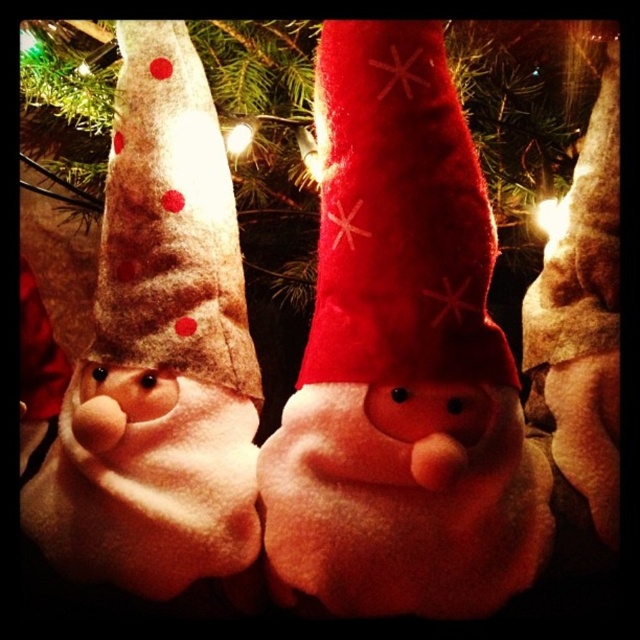
Question: Considering the real-world distances, which object is closest to the beige felt hat with red polka dots at left?

Choices:
 (A) beige felt gnome at left
 (B) red felt santa at center

Answer: (A)

Question: Estimate the real-world distances between objects in this image. Which object is closer to the felt christmas tree at center?

Choices:
 (A) red felt santa hat at center
 (B) red felt santa at center
 (C) beige felt gnome at left
 (D) beige felt hat with red polka dots at left

Answer: (A)

Question: Where is red felt santa at center located in relation to red felt santa hat at center in the image?

Choices:
 (A) below
 (B) above

Answer: (A)

Question: Can you confirm if red felt santa at center is smaller than beige felt gnome at left?

Choices:
 (A) yes
 (B) no

Answer: (B)

Question: Which point is closer to the camera?

Choices:
 (A) red felt santa hat at center
 (B) red felt santa at center
 (C) beige felt hat with red polka dots at left

Answer: (B)

Question: Is felt christmas tree at center above red felt santa hat at center?

Choices:
 (A) no
 (B) yes

Answer: (B)